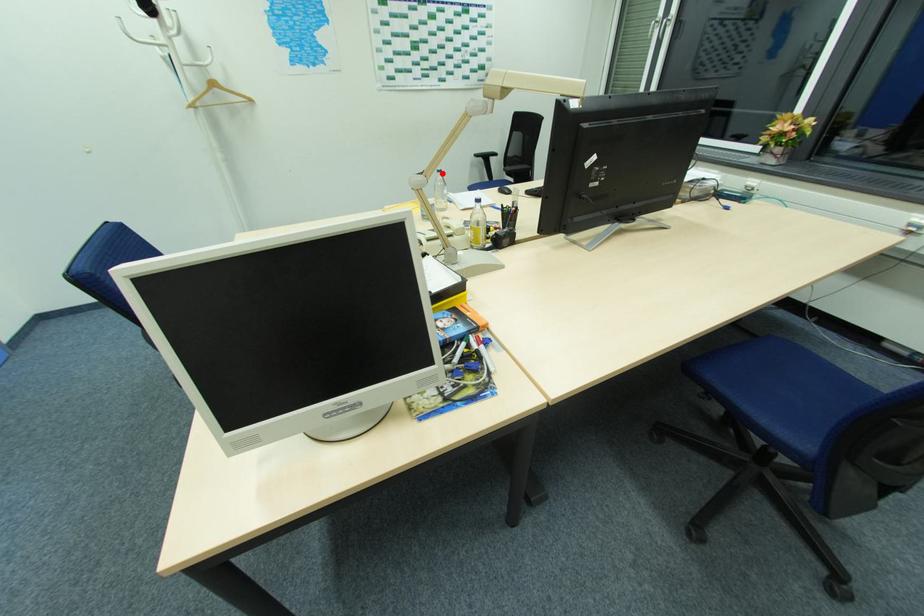
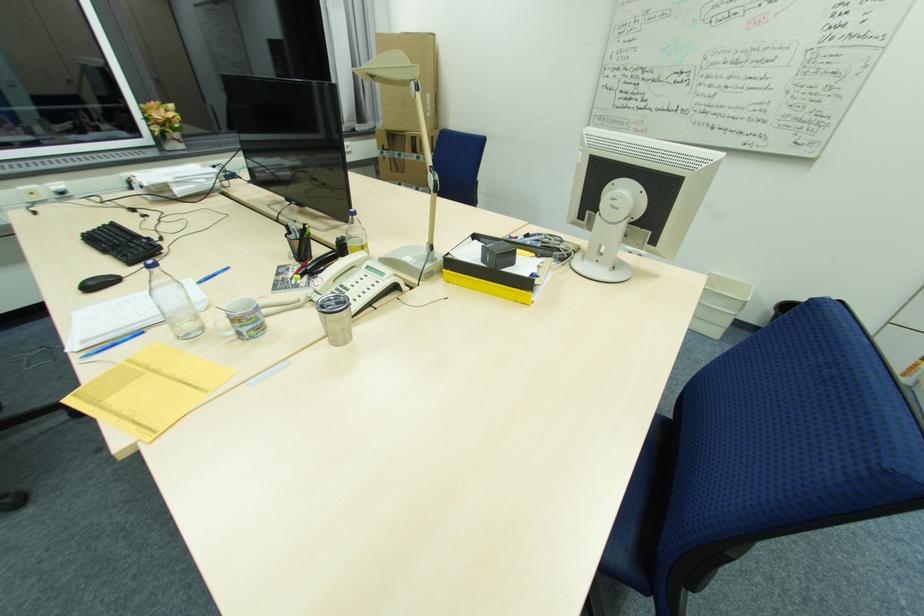
Question: I am providing you with two images of the same scene from different viewpoints. Given a red point in image1, look at the same physical point in image2. Is it:

Choices:
 (A) Closer to the viewpoint
 (B) Farther from the viewpoint

Answer: (B)